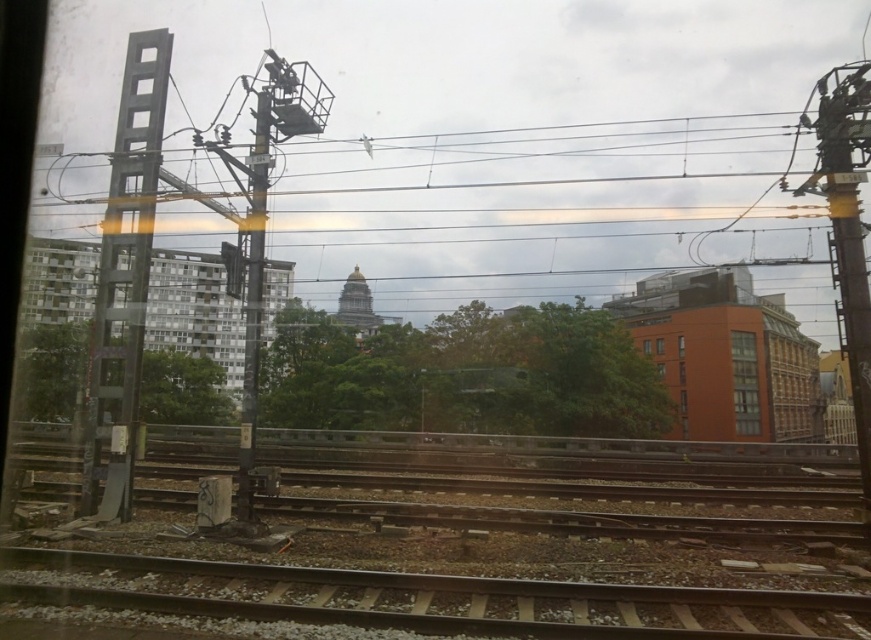
Describe the element at coordinates (659, 346) in the screenshot. I see `matte orange window at center-right` at that location.

Can you confirm if matte orange window at center-right is smaller than transparent glass window at center?

Incorrect, matte orange window at center-right is not smaller in size than transparent glass window at center.

I want to click on matte orange window at center-right, so click(x=659, y=346).

Is point (760, 428) positioned in front of point (680, 337)?

Yes, point (760, 428) is in front of point (680, 337).

Measure the distance between matte glass windows at center and camera.

matte glass windows at center and camera are 173.89 feet apart.

The height and width of the screenshot is (640, 871). What are the coordinates of `matte glass windows at center` in the screenshot? It's located at [745, 384].

Can you confirm if metallic gray pole at left is smaller than clear glass window at center?

Actually, metallic gray pole at left might be larger than clear glass window at center.

I want to click on metallic gray pole at left, so click(125, 278).

Locate an element on the screen. Image resolution: width=871 pixels, height=640 pixels. metallic gray pole at left is located at coordinates (125, 278).